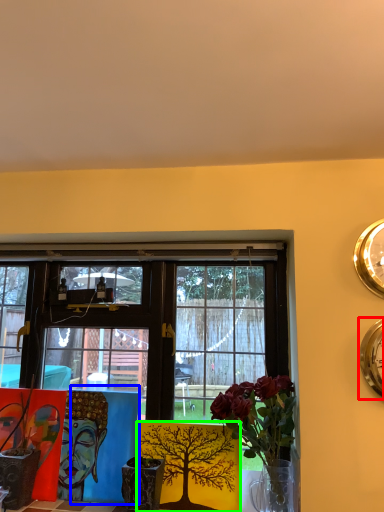
Question: Which object is positioned farthest from clock (highlighted by a red box)? Select from table (highlighted by a blue box) and floral arrangement (highlighted by a green box).

Choices:
 (A) table
 (B) floral arrangement

Answer: (A)